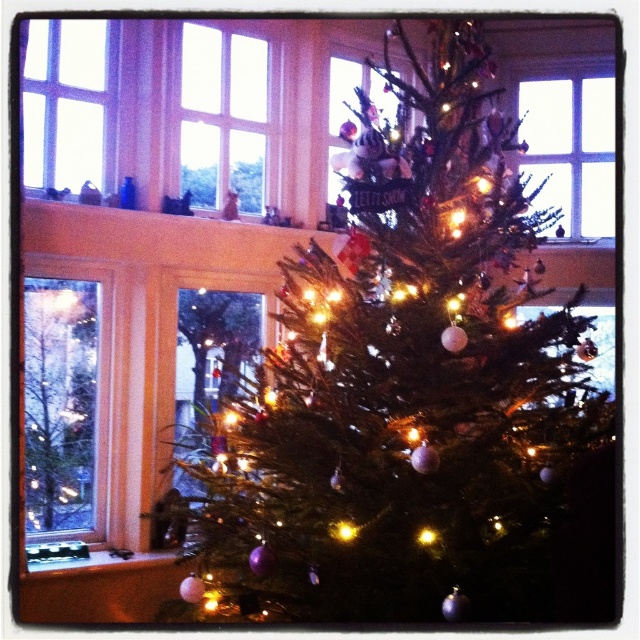
Question: Is shiny green pine tree at center closer to the viewer compared to matte black stove at lower left?

Choices:
 (A) yes
 (B) no

Answer: (A)

Question: Estimate the real-world distances between objects in this image. Which object is closer to the clear glass window at upper center?

Choices:
 (A) matte black stove at lower left
 (B) transparent glass window at upper right

Answer: (B)

Question: Where is transparent glass window at left located in relation to matte black stove at lower left in the image?

Choices:
 (A) below
 (B) above

Answer: (B)

Question: Is shiny green pine tree at center to the left of clear glass window at upper center from the viewer's perspective?

Choices:
 (A) no
 (B) yes

Answer: (A)

Question: Which object appears closest to the camera in this image?

Choices:
 (A) matte black stove at lower left
 (B) transparent glass at center

Answer: (B)

Question: Which of the following is the farthest from the observer?

Choices:
 (A) clear glass window at upper left
 (B) shiny green pine tree at center
 (C) clear glass window at upper center
 (D) transparent glass window at upper right

Answer: (D)